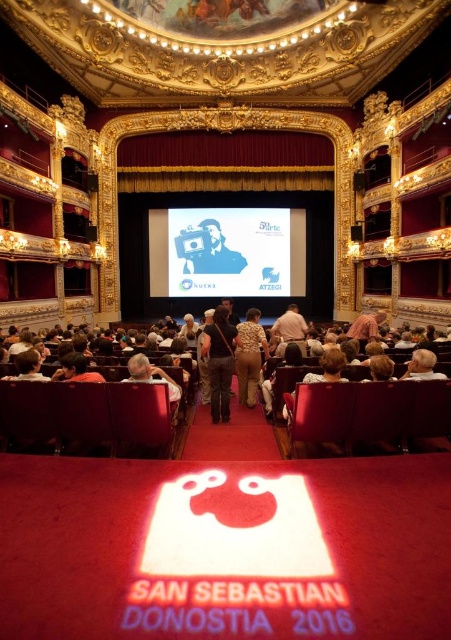
Question: Is blue glossy camera at center thinner than gold sequined dress at center?

Choices:
 (A) no
 (B) yes

Answer: (A)

Question: Considering the real-world distances, which object is farthest from the dark gray fabric jacket at center?

Choices:
 (A) gold sequined dress at center
 (B) white paper at center
 (C) blue glossy camera at center

Answer: (B)

Question: Considering the relative positions of white paper at center and blue glossy camera at center in the image provided, where is white paper at center located with respect to blue glossy camera at center?

Choices:
 (A) below
 (B) above

Answer: (A)

Question: Which point is farther to the camera?

Choices:
 (A) [228, 401]
 (B) [262, 236]
 (C) [197, 230]

Answer: (B)

Question: Estimate the real-world distances between objects in this image. Which object is farther from the gold sequined dress at center?

Choices:
 (A) blue glossy camera at center
 (B) white paper at center

Answer: (A)

Question: Is dark gray fabric jacket at center positioned behind blue glossy camera at center?

Choices:
 (A) yes
 (B) no

Answer: (B)